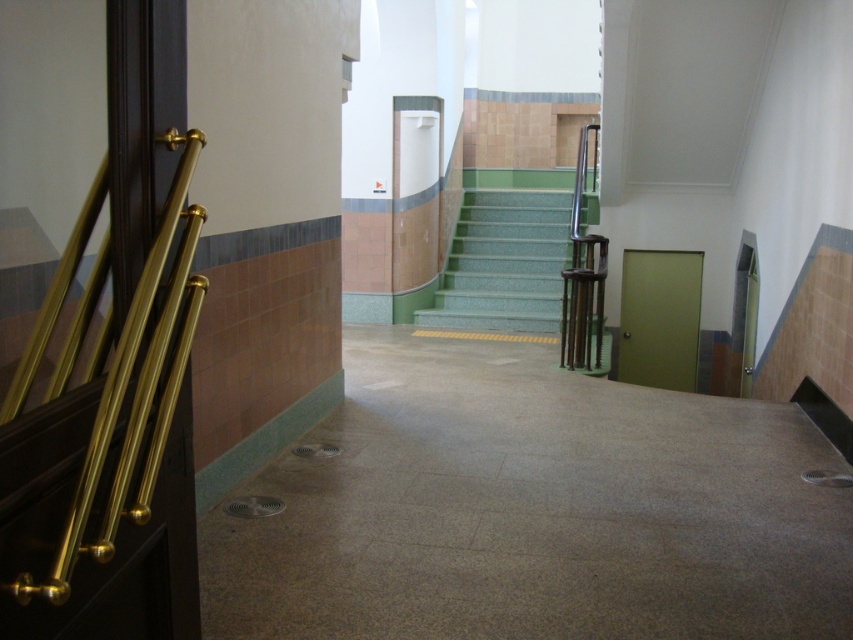
Is point (517, 257) in front of point (563, 344)?

No, it is behind (563, 344).

Which of these two, green speckled tile stairs at center or metallic polished rail at center-right, stands shorter?

Standing shorter between the two is green speckled tile stairs at center.

Is point (460, 273) farther from viewer compared to point (589, 257)?

Yes, point (460, 273) is farther from viewer.

Image resolution: width=853 pixels, height=640 pixels. Identify the location of green speckled tile stairs at center. (503, 260).